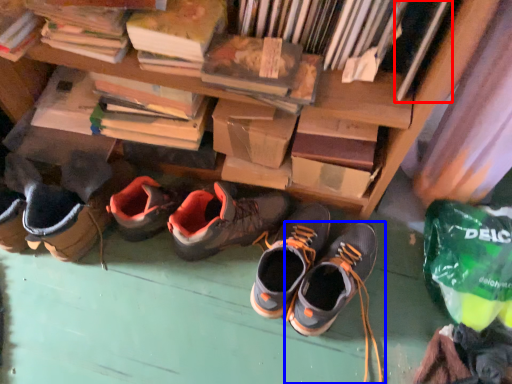
Question: Which of the following is the farthest to the observer, book (highlighted by a red box) or footwear (highlighted by a blue box)?

Choices:
 (A) book
 (B) footwear

Answer: (B)